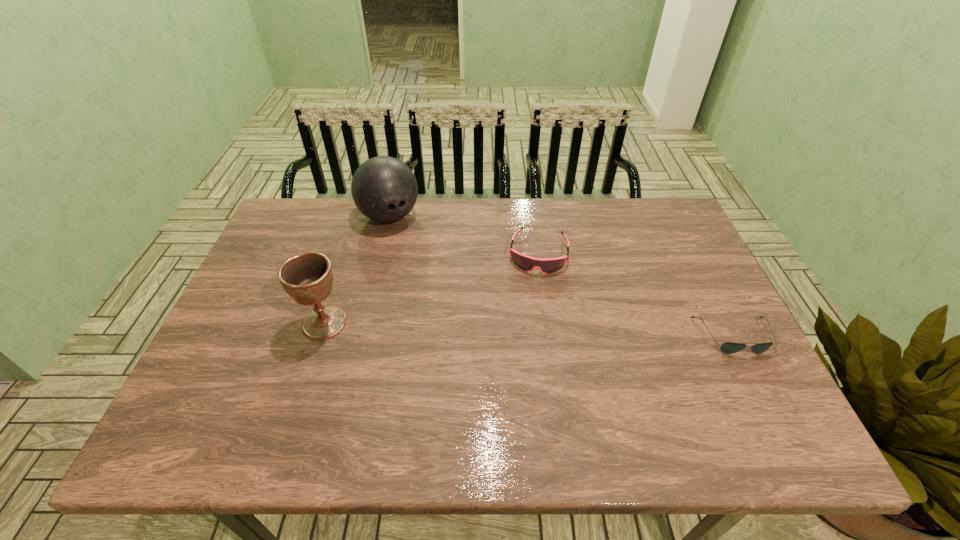
At what (x,y) coordinates should I click in order to perform the action: click on chalice. Please return your answer as a coordinate pair (x, y). Looking at the image, I should click on (307, 277).

I want to click on sunglasses, so click(728, 347).

Find the location of a particular element. The image size is (960, 540). the shortest object is located at coordinates (728, 347).

The height and width of the screenshot is (540, 960). I want to click on the third tallest object, so click(549, 265).

Find the location of a particular element. Image resolution: width=960 pixels, height=540 pixels. goggles is located at coordinates (549, 265).

Identify the location of bowling ball. The image size is (960, 540). (384, 189).

This screenshot has width=960, height=540. In order to click on vacant space located on the back of the chalice in this screenshot , I will do `click(344, 262)`.

I want to click on blank space located 0.090m on the lenses of the sunglasses, so click(x=760, y=389).

Where is `free space located 0.050m on the front-facing side of the third object from left to right`? The width and height of the screenshot is (960, 540). free space located 0.050m on the front-facing side of the third object from left to right is located at coordinates (534, 288).

The image size is (960, 540). In order to click on free region located on the front-facing side of the third object from left to right in this screenshot , I will do `click(533, 299)`.